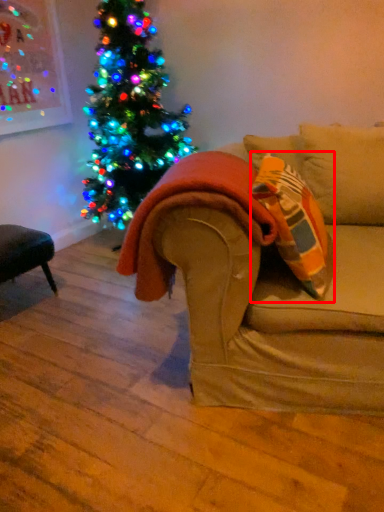
Question: From the image, what is the correct spatial relationship of throw pillow (annotated by the red box) in relation to blanket?

Choices:
 (A) right
 (B) left

Answer: (A)